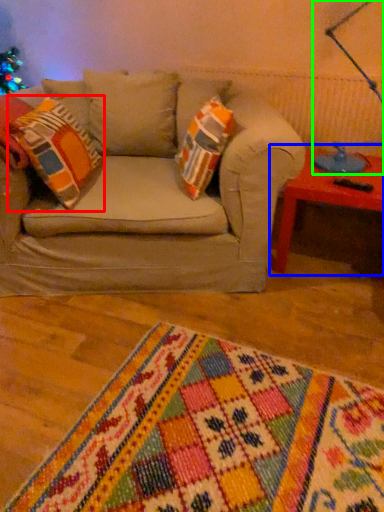
Question: Which object is positioned farthest from throw pillow (highlighted by a red box)? Select from table (highlighted by a blue box) and table lamp (highlighted by a green box).

Choices:
 (A) table
 (B) table lamp

Answer: (B)